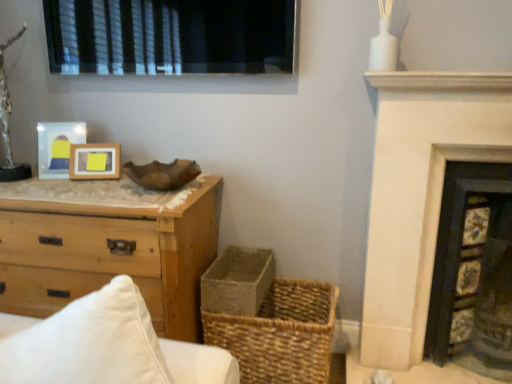
Question: Based on their sizes in the image, would you say black matte window at upper center is bigger or smaller than dark gray stone fireplace at right, positioned as the first fireplace in right-to-left order?

Choices:
 (A) small
 (B) big

Answer: (A)

Question: Considering their positions, is black matte window at upper center located in front of or behind dark gray stone fireplace at right, marked as the 2th fireplace in a left-to-right arrangement?

Choices:
 (A) front
 (B) behind

Answer: (B)

Question: Which of these objects is positioned closest to the woven straw basket at lower center?

Choices:
 (A) wooden frame at center, the second picture frame viewed from the left
 (B) rustic woven basket at lower center
 (C) black matte window at upper center
 (D) matte wood picture frame at upper left, which appears as the 1th picture frame when viewed from the left
 (E) white stone fireplace at upper right, which is counted as the first fireplace, starting from the left

Answer: (B)

Question: Estimate the real-world distances between objects in this image. Which object is closer to the dark gray stone fireplace at right, marked as the 2th fireplace in a left-to-right arrangement?

Choices:
 (A) white stone fireplace at upper right, the second fireplace viewed from the right
 (B) natural wood chest of drawers at left
 (C) rustic woven basket at lower center
 (D) black matte window at upper center
 (E) woven straw basket at lower center

Answer: (A)